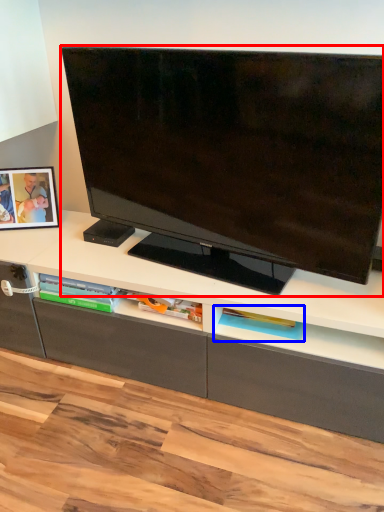
Question: Which object is further to the camera taking this photo, television (highlighted by a red box) or shelf (highlighted by a blue box)?

Choices:
 (A) television
 (B) shelf

Answer: (B)